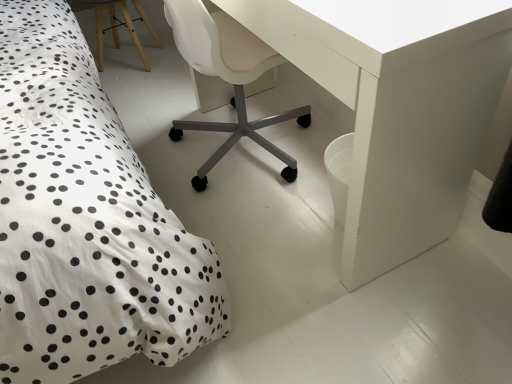
Question: Based on their sizes in the image, would you say white plastic chair at center is bigger or smaller than white glossy table at center?

Choices:
 (A) small
 (B) big

Answer: (A)

Question: From the image's perspective, is white plastic chair at center positioned above or below white glossy table at center?

Choices:
 (A) above
 (B) below

Answer: (A)

Question: Is white plastic chair at center to the left or to the right of white glossy table at center in the image?

Choices:
 (A) right
 (B) left

Answer: (B)

Question: Visually, is white glossy table at center positioned to the left or to the right of white plastic chair at center?

Choices:
 (A) right
 (B) left

Answer: (A)

Question: From their relative heights in the image, would you say white glossy table at center is taller or shorter than white plastic chair at center?

Choices:
 (A) tall
 (B) short

Answer: (A)

Question: In the image, is white glossy table at center positioned in front of or behind white plastic chair at center?

Choices:
 (A) front
 (B) behind

Answer: (A)

Question: Is white glossy table at center spatially inside white plastic chair at center, or outside of it?

Choices:
 (A) outside
 (B) inside

Answer: (B)